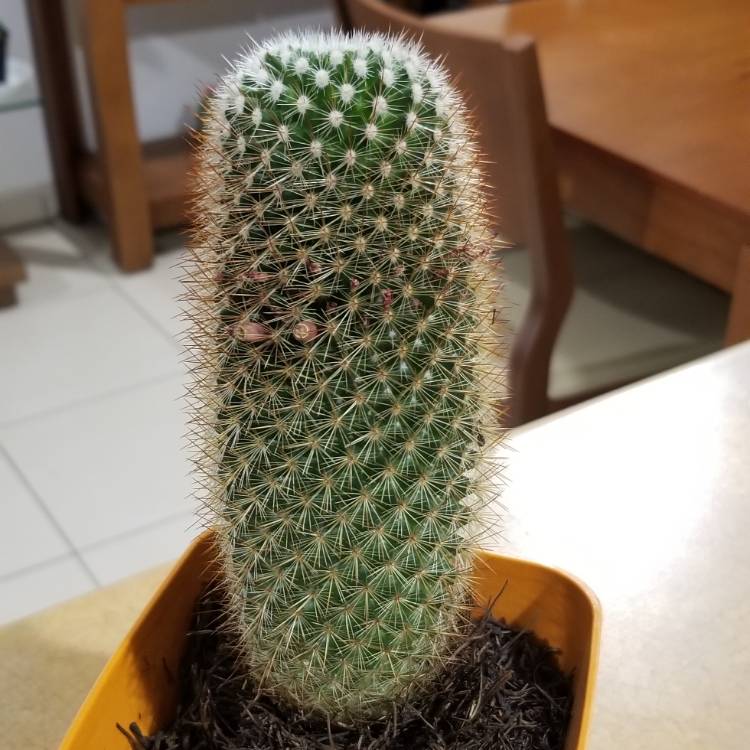
Identify the location of baseboard. click(36, 200).